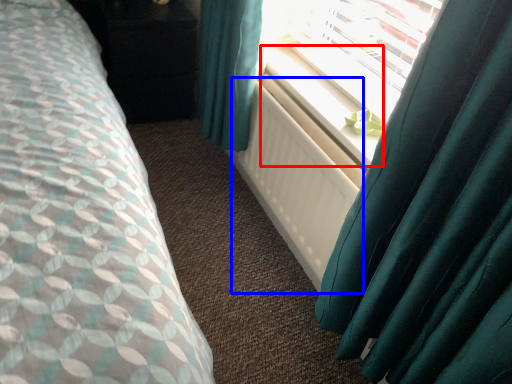
Question: Which object appears farthest to the camera in this image, window sill (highlighted by a red box) or radiator (highlighted by a blue box)?

Choices:
 (A) window sill
 (B) radiator

Answer: (A)